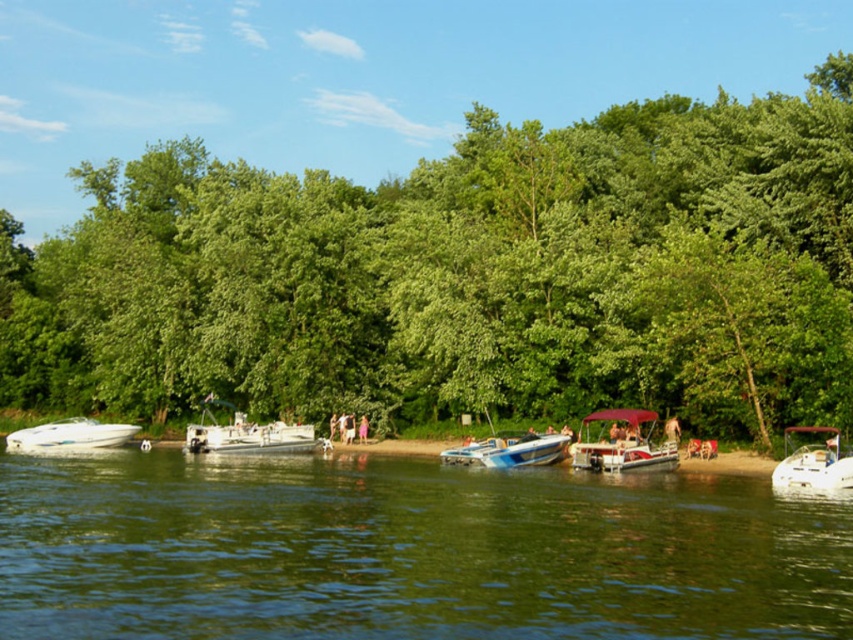
Is red fabric pontoon boat at center above white glossy boat at lower left?

Yes, red fabric pontoon boat at center is above white glossy boat at lower left.

Is red fabric pontoon boat at center to the left of white glossy boat at lower left from the viewer's perspective?

Incorrect, red fabric pontoon boat at center is not on the left side of white glossy boat at lower left.

Identify the location of red fabric pontoon boat at center. The height and width of the screenshot is (640, 853). (622, 444).

The width and height of the screenshot is (853, 640). I want to click on red fabric pontoon boat at center, so click(x=622, y=444).

Does green glossy water at center have a smaller size compared to blue plastic boat at center?

No.

Can you confirm if green glossy water at center is thinner than blue plastic boat at center?

No.

Who is more forward, (364, 500) or (482, 451)?

Point (364, 500) is more forward.

In order to click on green glossy water at center in this screenshot , I will do `click(407, 550)`.

Is red fabric pontoon boat at center behind blue plastic boat at center?

No, it is in front of blue plastic boat at center.

Find the location of a particular element. red fabric pontoon boat at center is located at coordinates (622, 444).